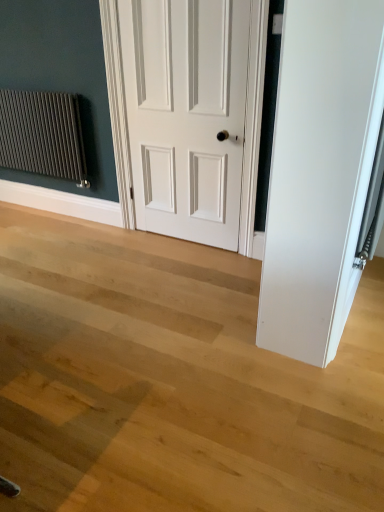
Question: Is matte dark gray radiator at left further to the viewer compared to white matte door at center?

Choices:
 (A) yes
 (B) no

Answer: (A)

Question: Is white matte door at center at the back of matte dark gray radiator at left?

Choices:
 (A) no
 (B) yes

Answer: (A)

Question: Is matte dark gray radiator at left positioned beyond the bounds of white matte door at center?

Choices:
 (A) no
 (B) yes

Answer: (B)

Question: Does matte dark gray radiator at left have a greater height compared to white matte door at center?

Choices:
 (A) yes
 (B) no

Answer: (B)

Question: From a real-world perspective, is matte dark gray radiator at left positioned under white matte door at center based on gravity?

Choices:
 (A) yes
 (B) no

Answer: (A)

Question: Does matte dark gray radiator at left have a lesser height compared to white matte door at center?

Choices:
 (A) no
 (B) yes

Answer: (B)

Question: Is white matte door at center at the left side of matte dark gray radiator at left?

Choices:
 (A) yes
 (B) no

Answer: (B)

Question: Is white matte door at center facing away from matte dark gray radiator at left?

Choices:
 (A) no
 (B) yes

Answer: (A)

Question: Can you confirm if white matte door at center is positioned to the right of matte dark gray radiator at left?

Choices:
 (A) no
 (B) yes

Answer: (B)

Question: From the image's perspective, is white matte door at center on top of matte dark gray radiator at left?

Choices:
 (A) yes
 (B) no

Answer: (B)

Question: Is white matte door at center positioned behind matte dark gray radiator at left?

Choices:
 (A) no
 (B) yes

Answer: (A)

Question: Could you tell me if white matte door at center is facing matte dark gray radiator at left?

Choices:
 (A) yes
 (B) no

Answer: (B)

Question: From a real-world perspective, is matte dark gray radiator at left physically located above or below white matte door at center?

Choices:
 (A) below
 (B) above

Answer: (A)